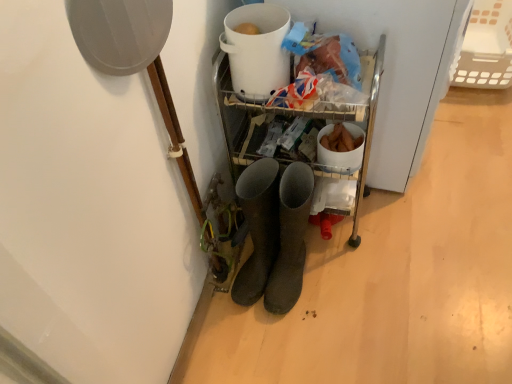
Question: Considering the positions of dark gray rubber boots at center and white plastic bucket at upper center in the image, is dark gray rubber boots at center bigger or smaller than white plastic bucket at upper center?

Choices:
 (A) big
 (B) small

Answer: (A)

Question: Is dark gray rubber boots at center inside the boundaries of white plastic bucket at upper center, or outside?

Choices:
 (A) outside
 (B) inside

Answer: (A)

Question: Which object is the farthest from the dark gray rubber boots at center?

Choices:
 (A) white plastic bucket at upper center
 (B) white plastic basket at upper right

Answer: (B)

Question: Based on their relative distances, which object is farther from the white plastic basket at upper right?

Choices:
 (A) white plastic bucket at upper center
 (B) dark gray rubber boots at center

Answer: (B)